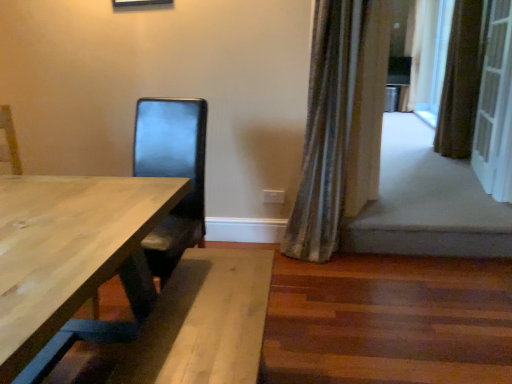
Question: Is white textured screen door at right positioned before brown textured curtain at right, placed as the 2th curtain when sorted from right to left?

Choices:
 (A) no
 (B) yes

Answer: (B)

Question: Is white textured screen door at right wider than brown textured curtain at right, the 2th curtain when ordered from back to front?

Choices:
 (A) yes
 (B) no

Answer: (B)

Question: From the image's perspective, is white textured screen door at right located beneath brown textured curtain at right, placed as the 2th curtain when sorted from right to left?

Choices:
 (A) no
 (B) yes

Answer: (B)

Question: Is white textured screen door at right oriented towards brown textured curtain at right, the 2th curtain when ordered from back to front?

Choices:
 (A) yes
 (B) no

Answer: (B)

Question: From the image's perspective, is white textured screen door at right above brown textured curtain at right, which is the 2th curtain in front-to-back order?

Choices:
 (A) yes
 (B) no

Answer: (B)

Question: Considering their positions, is white textured screen door at right located in front of or behind silky beige curtain at upper right, the first curtain positioned from the back?

Choices:
 (A) behind
 (B) front

Answer: (B)

Question: Is white textured screen door at right bigger or smaller than silky beige curtain at upper right, marked as the 3th curtain in a front-to-back arrangement?

Choices:
 (A) big
 (B) small

Answer: (B)

Question: From a real-world perspective, is white textured screen door at right positioned above or below silky beige curtain at upper right, which appears as the 1th curtain when viewed from the right?

Choices:
 (A) below
 (B) above

Answer: (A)

Question: Based on their positions, is white textured screen door at right located to the left or right of silky beige curtain at upper right, the first curtain positioned from the back?

Choices:
 (A) right
 (B) left

Answer: (B)

Question: Considering the positions of silky green curtain at right, which is counted as the first curtain, starting from the left, and silky beige curtain at upper right, marked as the 3th curtain in a left-to-right arrangement, in the image, is silky green curtain at right, which is counted as the first curtain, starting from the left, bigger or smaller than silky beige curtain at upper right, marked as the 3th curtain in a left-to-right arrangement,?

Choices:
 (A) small
 (B) big

Answer: (B)

Question: Would you say silky green curtain at right, the 1th curtain positioned from the front, is inside or outside silky beige curtain at upper right, marked as the 3th curtain in a left-to-right arrangement?

Choices:
 (A) outside
 (B) inside

Answer: (A)

Question: Considering their positions, is silky green curtain at right, which is counted as the first curtain, starting from the left, located in front of or behind silky beige curtain at upper right, marked as the 3th curtain in a left-to-right arrangement?

Choices:
 (A) behind
 (B) front

Answer: (B)

Question: Is silky green curtain at right, the 1th curtain positioned from the front, wider or thinner than silky beige curtain at upper right, the first curtain positioned from the back?

Choices:
 (A) thin
 (B) wide

Answer: (A)

Question: From a real-world perspective, is silky green curtain at right, which is counted as the first curtain, starting from the left, above or below brown textured curtain at right, which is the 2th curtain in front-to-back order?

Choices:
 (A) below
 (B) above

Answer: (A)

Question: Based on their sizes in the image, would you say silky green curtain at right, the third curtain viewed from the right, is bigger or smaller than brown textured curtain at right, placed as the 2th curtain when sorted from right to left?

Choices:
 (A) small
 (B) big

Answer: (B)